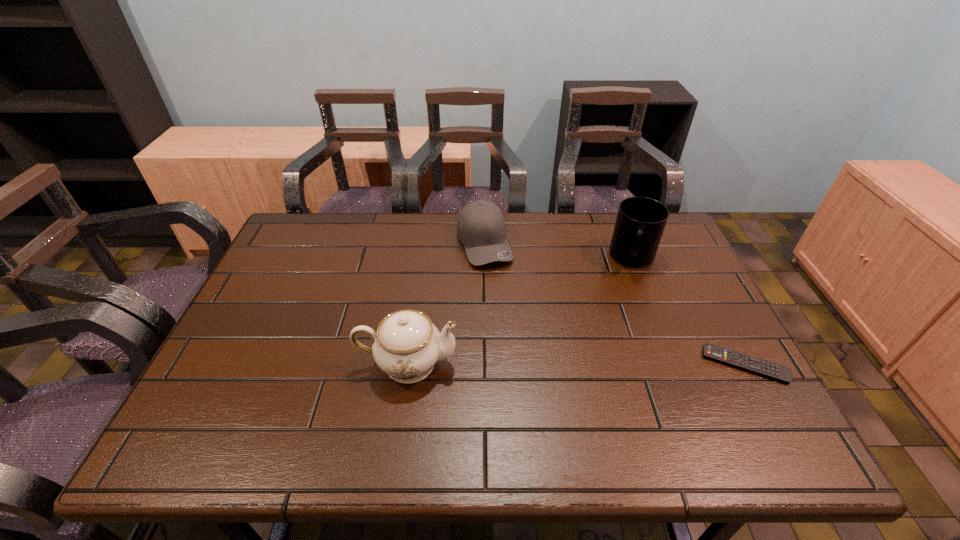
Identify the location of chinaware. (407, 345).

Where is `remote control`? remote control is located at coordinates (741, 361).

Identify the location of the shortest object. The height and width of the screenshot is (540, 960). (741, 361).

Image resolution: width=960 pixels, height=540 pixels. In order to click on mug in this screenshot , I will do `click(640, 222)`.

Where is `the third tallest object`? The height and width of the screenshot is (540, 960). the third tallest object is located at coordinates (481, 227).

Image resolution: width=960 pixels, height=540 pixels. I want to click on vacant space located 0.280m at the spout of the chinaware, so click(575, 363).

The image size is (960, 540). I want to click on free space located on the back of the rightmost object, so click(x=715, y=310).

Where is `vacant space positioned on the side of the mug with the handle`? The image size is (960, 540). vacant space positioned on the side of the mug with the handle is located at coordinates coord(620,354).

Locate an element on the screen. vacant space located on the side of the mug with the handle is located at coordinates [626, 314].

At what (x,y) coordinates should I click in order to perform the action: click on vacant space located 0.210m on the side of the mug with the handle. Please return your answer as a coordinate pair (x, y). Looking at the image, I should click on (624, 327).